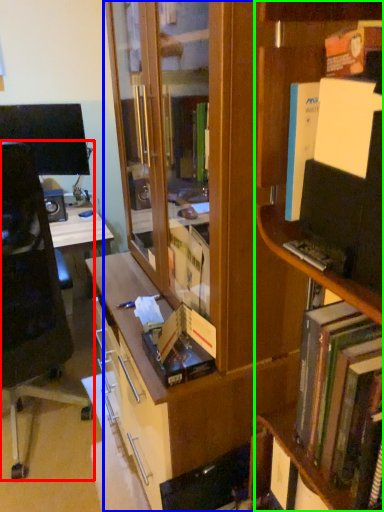
Question: Which is nearer to the chair (highlighted by a red box)? bookcase (highlighted by a blue box) or shelf (highlighted by a green box).

Choices:
 (A) bookcase
 (B) shelf

Answer: (A)